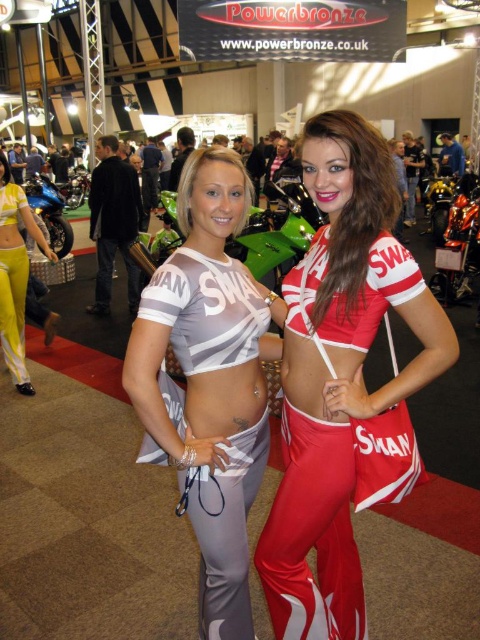
You are a photographer at the motorcycle exhibition. You need to decide which outfit between the matte red fabric outfit at center and the yellow fabric top at left is more suitable for a closeup shot. Considering their sizes, which one would be better to focus on?

The matte red fabric outfit at center has a larger size compared to the yellow fabric top at left, so it would be more suitable for a closeup shot as its larger size allows for more detailed focus.

You are a photographer at the motorcycle exhibition. You want to take a photo that includes both the yellow fabric top at left and the shiny blue motorcycle at left. Which object should you focus on first if you want to ensure both are in frame?

The yellow fabric top at left is smaller than the shiny blue motorcycle at left. To ensure both are in frame, focus on the shiny blue motorcycle at left first since it is larger and will require more space in the composition.

You are a photographer at the exhibition and want to take a photo of both motorcycles. Since you are standing at the front, which motorcycle, the shiny blue motorcycle at left or the shiny metallic motorcycle at center right, is nearer to you?

The shiny blue motorcycle at left is closer to the viewer than the shiny metallic motorcycle at center right, so the shiny blue motorcycle at left is nearer to you.